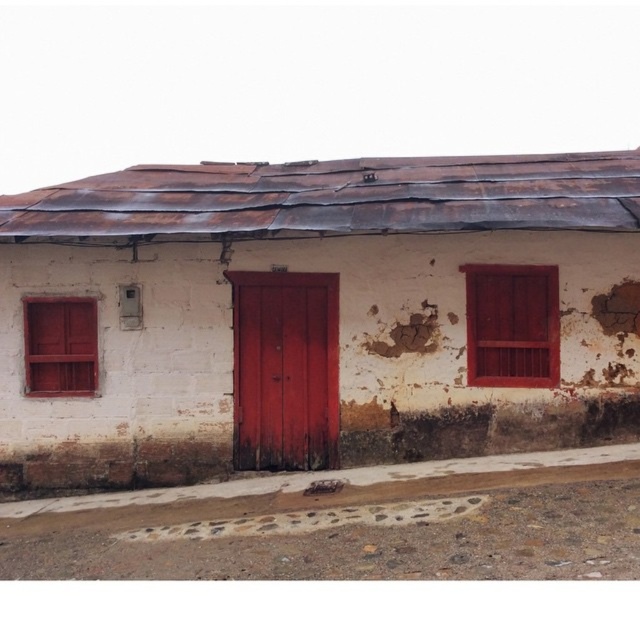
You are standing in front of the building and want to enter. Which object should you use to enter the building? The smooth glossy wood door at center or the wooden at right?

The smooth glossy wood door at center is located below the wooden at right, so you should use the smooth glossy wood door at center to enter the building since it is the lower entrance point.

You are standing at a distance of 30 feet from the building. You want to reach the point marked at coordinates point (240, 387). Can you reach it without moving closer than your current position?

The distance of point (240, 387) from viewer is 32.58 feet, which is farther than your current position of 30 feet. Therefore, you cannot reach it without moving closer.